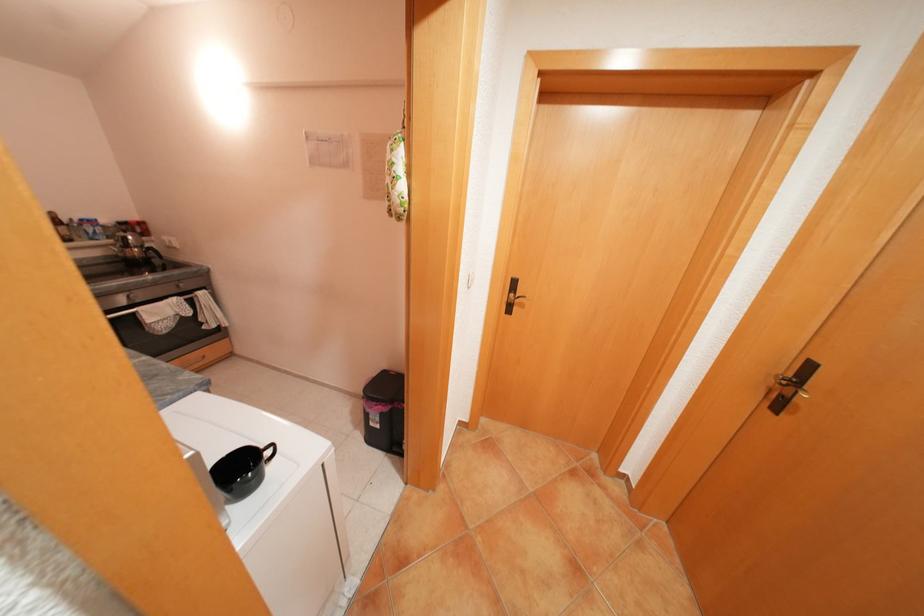
Describe the element at coordinates (129, 297) in the screenshot. I see `a oven door handle` at that location.